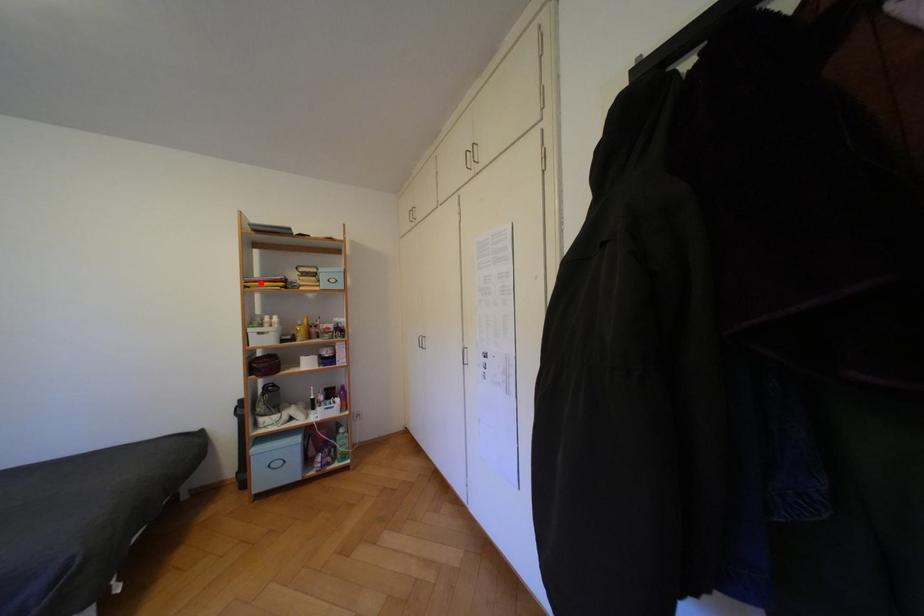
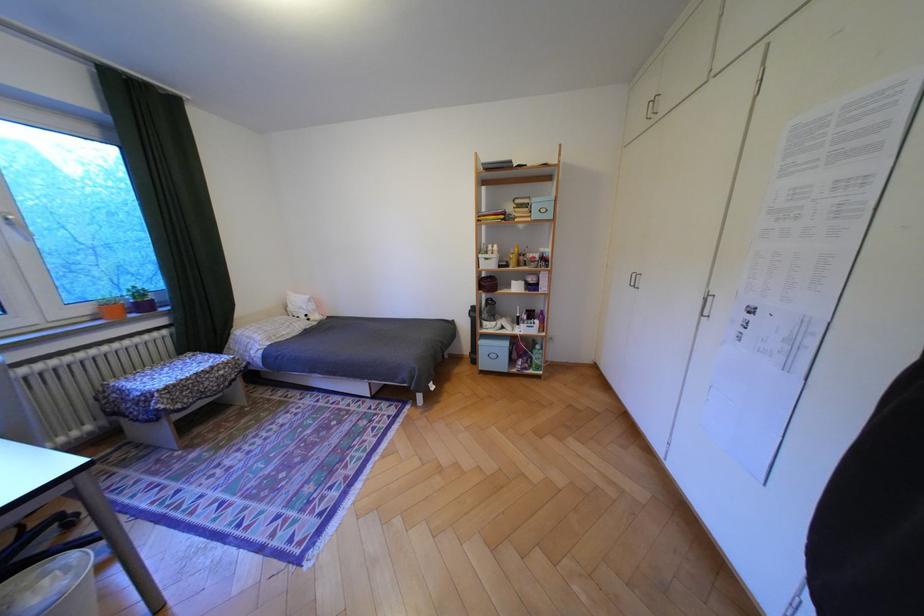
Question: I am providing you with two images of the same scene from different viewpoints. In image1, a red point is highlighted. Considering the same 3D point in image2, which of the following is correct?

Choices:
 (A) It is closer
 (B) It is farther

Answer: (A)